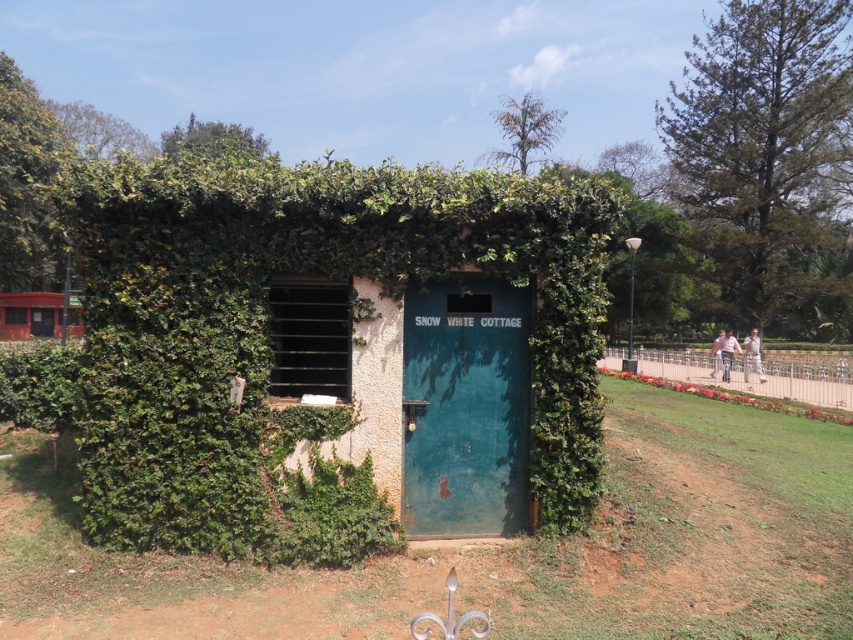
You are a painter who needs to cover both the green textured door at center and the orange painted wooden signboard at left with a fresh coat of paint. If you have enough paint to cover 2 square meters, will you have enough paint for both?

The green textured door at center is wider than the orange painted wooden signboard at left. Since the door is larger in size, the total area to be painted exceeds 2 square meters, so the available paint is insufficient.

You are a delivery person trying to find the SNOW WHITE COTTAGE. You see the teal matte door at center and the orange painted wooden signboard at left. Which object is located to the right of the other?

The teal matte door at center is positioned on the right side of orange painted wooden signboard at left.

You are a delivery person trying to deliver a package to the teal matte door at center. You see an orange painted wooden signboard at left nearby. Can you walk from the signboard to the door without any obstacles?

The teal matte door at center is 41.99 meters away from the orange painted wooden signboard at left. Since the path is clear between them, you can walk from the signboard to the door without any obstacles.